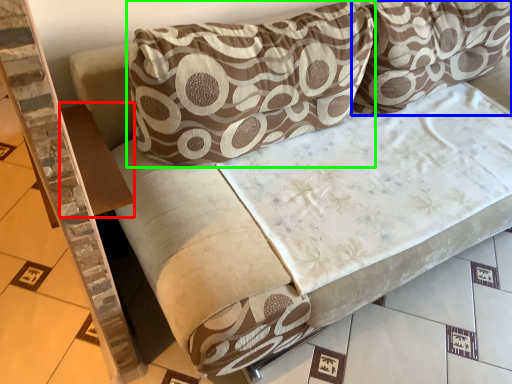
Question: Which object is the farthest from table (highlighted by a red box)? Choose among these: pillow (highlighted by a blue box) or pillow (highlighted by a green box).

Choices:
 (A) pillow
 (B) pillow

Answer: (A)